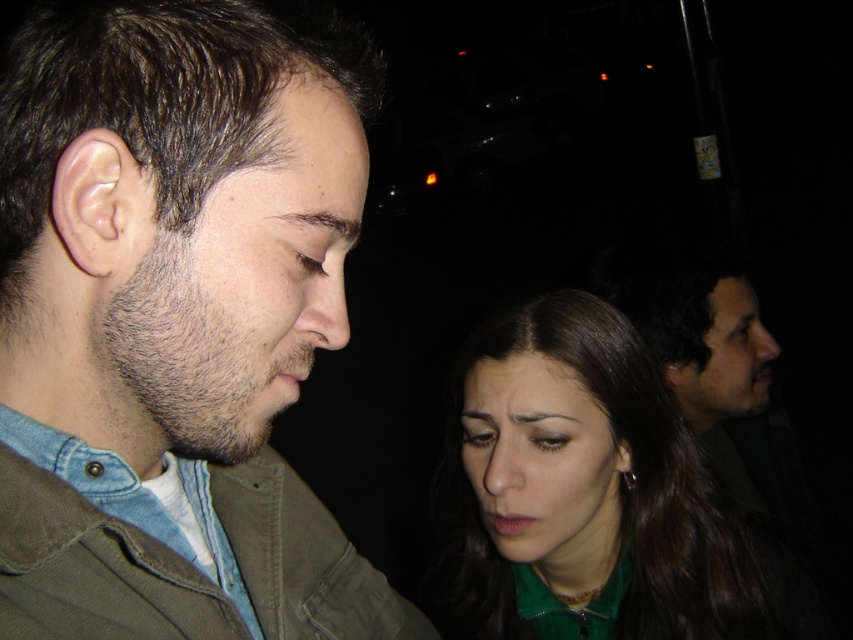
Does dark brown hair at right come behind dark brown hair at upper center?

Yes, it is.

In the scene shown: Is dark brown hair at right above dark brown hair at upper center?

No, dark brown hair at right is not above dark brown hair at upper center.

Who is more distant from viewer, (677, 310) or (314, 108)?

Point (677, 310)

Find the location of `dark brown hair at right`. dark brown hair at right is located at coordinates (697, 337).

Does green matte shirt at lower right have a greater height compared to dark brown hair at right?

Incorrect, green matte shirt at lower right's height is not larger of dark brown hair at right's.

Does green matte shirt at lower right have a larger size compared to dark brown hair at right?

Yes.

You are a GUI agent. You are given a task and a screenshot of the screen. Output one action in this format:
    pyautogui.click(x=<x>, y=<y>)
    Task: Click on the green matte shirt at lower right
    This screenshot has height=640, width=853.
    Given the screenshot: What is the action you would take?
    pyautogui.click(x=585, y=483)

Can you confirm if denim jacket at left is positioned to the right of dark brown hair at upper center?

In fact, denim jacket at left is to the left of dark brown hair at upper center.

Between denim jacket at left and dark brown hair at upper center, which one appears on the left side from the viewer's perspective?

denim jacket at left is more to the left.

Is point (177, 433) positioned behind point (247, 209)?

Yes, it is.

You are a GUI agent. You are given a task and a screenshot of the screen. Output one action in this format:
    pyautogui.click(x=<x>, y=<y>)
    Task: Click on the denim jacket at left
    This screenshot has height=640, width=853.
    Given the screenshot: What is the action you would take?
    pyautogui.click(x=173, y=323)